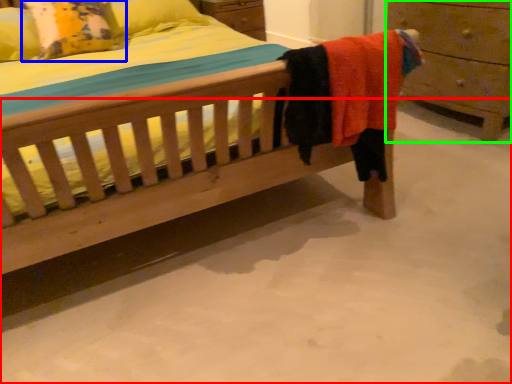
Question: Which object is positioned farthest from concrete (highlighted by a red box)? Select from pillow (highlighted by a blue box) and chest of drawers (highlighted by a green box).

Choices:
 (A) pillow
 (B) chest of drawers

Answer: (A)